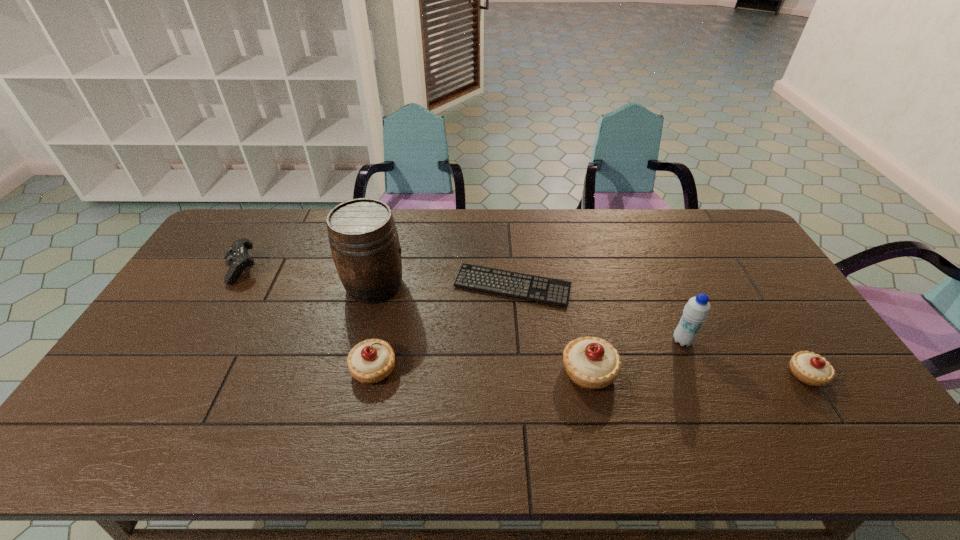
The height and width of the screenshot is (540, 960). I want to click on empty space between the cider and the fifth shortest object, so [x=482, y=328].

The height and width of the screenshot is (540, 960). Find the location of `free space between the tallest pastry and the second tallest pastry`. free space between the tallest pastry and the second tallest pastry is located at coordinates (482, 369).

I want to click on vacant space in between the control and the shortest pastry, so click(x=523, y=322).

Identify the location of vacant space that is in between the cider and the sixth shortest object. This screenshot has height=540, width=960. (529, 313).

Choose which object is the fifth nearest neighbor to the leftmost object. Please provide its 2D coordinates. Your answer should be formatted as a tuple, i.e. [(x, y)], where the tuple contains the x and y coordinates of a point satisfying the conditions above.

[(696, 311)]

You are a GUI agent. You are given a task and a screenshot of the screen. Output one action in this format:
    pyautogui.click(x=<x>, y=<y>)
    Task: Click on the object that is the sixth closest one to the leftmost object
    The height and width of the screenshot is (540, 960).
    Given the screenshot: What is the action you would take?
    pyautogui.click(x=810, y=368)

Locate which pastry is the closest to the leftmost object. Please provide its 2D coordinates. Your answer should be formatted as a tuple, i.e. [(x, y)], where the tuple contains the x and y coordinates of a point satisfying the conditions above.

[(370, 361)]

Select which pastry appears as the closest to the rightmost object. Please provide its 2D coordinates. Your answer should be formatted as a tuple, i.e. [(x, y)], where the tuple contains the x and y coordinates of a point satisfying the conditions above.

[(593, 363)]

The width and height of the screenshot is (960, 540). I want to click on free point that satisfies the following two spatial constraints: 1. on the back side of the fourth tallest object; 2. on the side of the cider near the bung hole, so click(x=392, y=285).

The width and height of the screenshot is (960, 540). In order to click on blank area in the image that satisfies the following two spatial constraints: 1. on the side of the shortest pastry near the bung hole; 2. on the left side of the tallest object in this screenshot , I will do `click(352, 374)`.